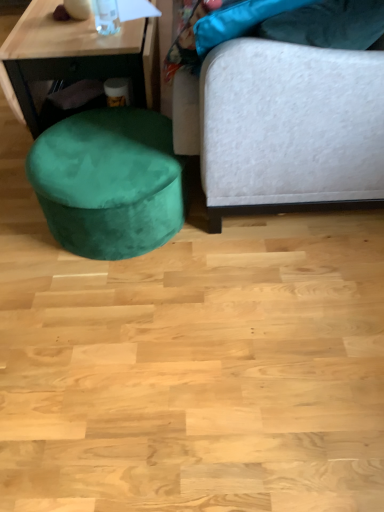
Describe the element at coordinates (106, 16) in the screenshot. I see `transparent glass bottle at upper left` at that location.

Locate an element on the screen. velvet green ottoman at lower left is located at coordinates (108, 182).

What do you see at coordinates (108, 182) in the screenshot?
I see `velvet green ottoman at lower left` at bounding box center [108, 182].

Where is `transparent glass bottle at upper left`? transparent glass bottle at upper left is located at coordinates (106, 16).

Is velvet green ottoman at lower left positioned behind velvet white studio couch at right?

Yes.

Is velvet green ottoman at lower left inside the boundaries of velvet white studio couch at right, or outside?

velvet green ottoman at lower left exists outside the volume of velvet white studio couch at right.

Who is bigger, velvet green ottoman at lower left or velvet white studio couch at right?

velvet white studio couch at right is bigger.

What's the angular difference between transparent glass bottle at upper left and velvet white studio couch at right's facing directions?

There is a 0.826-degree angle between the facing directions of transparent glass bottle at upper left and velvet white studio couch at right.

In the image, there is a velvet white studio couch at right. At what (x,y) coordinates should I click in order to perform the action: click on bottle below it (from the image's perspective). Please return your answer as a coordinate pair (x, y). The width and height of the screenshot is (384, 512). Looking at the image, I should click on (106, 16).

Looking at this image, is transparent glass bottle at upper left at the right side of velvet white studio couch at right?

No, transparent glass bottle at upper left is not to the right of velvet white studio couch at right.

How much distance is there between velvet white studio couch at right and velvet green ottoman at lower left?

velvet white studio couch at right is 13.69 inches away from velvet green ottoman at lower left.

From the image's perspective, between velvet white studio couch at right and velvet green ottoman at lower left, which one is located above?

velvet white studio couch at right, from the image's perspective.

Is velvet white studio couch at right not within velvet green ottoman at lower left?

Yes.

Identify the location of music stool that appears below the velvet white studio couch at right (from a real-world perspective). (108, 182).

This screenshot has width=384, height=512. In order to click on music stool on the right of the velvet green ottoman at lower left in this screenshot , I will do `click(108, 182)`.

Is point (56, 76) behind point (82, 176)?

That is True.

Does velvet green ottoman at lower left have a smaller size compared to velvet green ottoman at lower left?

Incorrect, velvet green ottoman at lower left is not smaller in size than velvet green ottoman at lower left.

In the scene shown: Could you tell me if velvet green ottoman at lower left is turned towards velvet green ottoman at lower left?

No, velvet green ottoman at lower left is not turned towards velvet green ottoman at lower left.

Does point (114, 7) appear closer or farther from the camera than point (162, 138)?

Clearly, point (114, 7) is more distant from the camera than point (162, 138).

Does transparent glass bottle at upper left have a larger size compared to velvet green ottoman at lower left?

Actually, transparent glass bottle at upper left might be smaller than velvet green ottoman at lower left.

How distant is transparent glass bottle at upper left from velvet green ottoman at lower left?

22.46 inches.

Which object is wider, transparent glass bottle at upper left or velvet green ottoman at lower left?

With larger width is velvet green ottoman at lower left.

From a real-world perspective, who is located higher, velvet green ottoman at lower left or transparent glass bottle at upper left?

transparent glass bottle at upper left.

Consider the image. Considering the relative sizes of velvet green ottoman at lower left and transparent glass bottle at upper left in the image provided, is velvet green ottoman at lower left wider than transparent glass bottle at upper left?

Correct, the width of velvet green ottoman at lower left exceeds that of transparent glass bottle at upper left.

Is the position of velvet green ottoman at lower left more distant than that of transparent glass bottle at upper left?

Yes, velvet green ottoman at lower left is further from the camera.

From a real-world perspective, between velvet green ottoman at lower left and velvet green ottoman at lower left, who is vertically higher?

In real-world perspective, velvet green ottoman at lower left is above.

Do you think velvet green ottoman at lower left is within velvet green ottoman at lower left, or outside of it?

velvet green ottoman at lower left is not inside velvet green ottoman at lower left, it's outside.

Is velvet green ottoman at lower left next to velvet green ottoman at lower left and touching it?

No, velvet green ottoman at lower left is not beside velvet green ottoman at lower left.

Image resolution: width=384 pixels, height=512 pixels. In the image, there is a velvet green ottoman at lower left. What are the coordinates of `studio couch above it (from the image's perspective)` in the screenshot? It's located at (284, 120).

This screenshot has height=512, width=384. I want to click on bottle behind the velvet white studio couch at right, so click(106, 16).

When comparing their distances from velvet green ottoman at lower left, does velvet white studio couch at right or velvet green ottoman at lower left seem closer?

Among the two, velvet white studio couch at right is located nearer to velvet green ottoman at lower left.

When comparing their distances from transparent glass bottle at upper left, does velvet green ottoman at lower left or velvet white studio couch at right seem further?

velvet white studio couch at right.

Based on their spatial positions, is velvet green ottoman at lower left or velvet green ottoman at lower left further from velvet white studio couch at right?

velvet green ottoman at lower left is positioned further to the anchor velvet white studio couch at right.

Which object lies further to the anchor point velvet green ottoman at lower left, velvet white studio couch at right or velvet green ottoman at lower left?

Among the two, velvet white studio couch at right is located further to velvet green ottoman at lower left.

Looking at the image, which one is located further to velvet green ottoman at lower left, transparent glass bottle at upper left or velvet green ottoman at lower left?

The object further to velvet green ottoman at lower left is velvet green ottoman at lower left.

Which object lies further to the anchor point velvet green ottoman at lower left, velvet white studio couch at right or transparent glass bottle at upper left?

transparent glass bottle at upper left.

Which object lies nearer to the anchor point velvet white studio couch at right, velvet green ottoman at lower left or transparent glass bottle at upper left?

velvet green ottoman at lower left lies closer to velvet white studio couch at right than the other object.

Looking at this image, which object lies further to the anchor point transparent glass bottle at upper left, velvet green ottoman at lower left or velvet green ottoman at lower left?

The object further to transparent glass bottle at upper left is velvet green ottoman at lower left.

Find the location of a particular element. The width and height of the screenshot is (384, 512). table between transparent glass bottle at upper left and velvet green ottoman at lower left in the vertical direction is located at coordinates (78, 55).

The width and height of the screenshot is (384, 512). I want to click on bottle situated between velvet green ottoman at lower left and velvet white studio couch at right from left to right, so click(106, 16).

Locate an element on the screen. bottle that lies between velvet white studio couch at right and velvet green ottoman at lower left from top to bottom is located at coordinates (106, 16).

Identify the location of music stool between velvet green ottoman at lower left and velvet white studio couch at right. (108, 182).